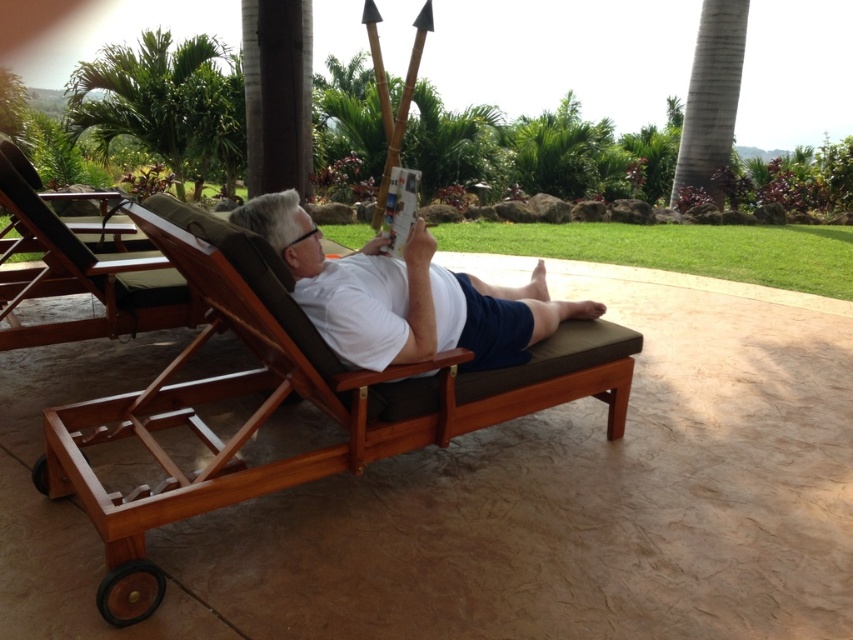
Question: From the image, what is the correct spatial relationship of teak wood beach chair at center in relation to green leafy palm tree at upper left?

Choices:
 (A) right
 (B) left

Answer: (A)

Question: Which of the following is the closest to the observer?

Choices:
 (A) brown wood beach chair at left
 (B) teak wood beach chair at center

Answer: (B)

Question: Observing the image, what is the correct spatial positioning of teak wood beach chair at center in reference to green leafy palm tree at upper left?

Choices:
 (A) left
 (B) right

Answer: (B)

Question: Can you confirm if teak wood beach chair at center is positioned to the right of white matte shirt at center?

Choices:
 (A) no
 (B) yes

Answer: (A)

Question: Among these points, which one is farthest from the camera?

Choices:
 (A) (196, 42)
 (B) (354, 380)

Answer: (A)

Question: Which object is farther from the camera taking this photo?

Choices:
 (A) brown wood beach chair at left
 (B) teak wood beach chair at center
 (C) white matte shirt at center

Answer: (A)